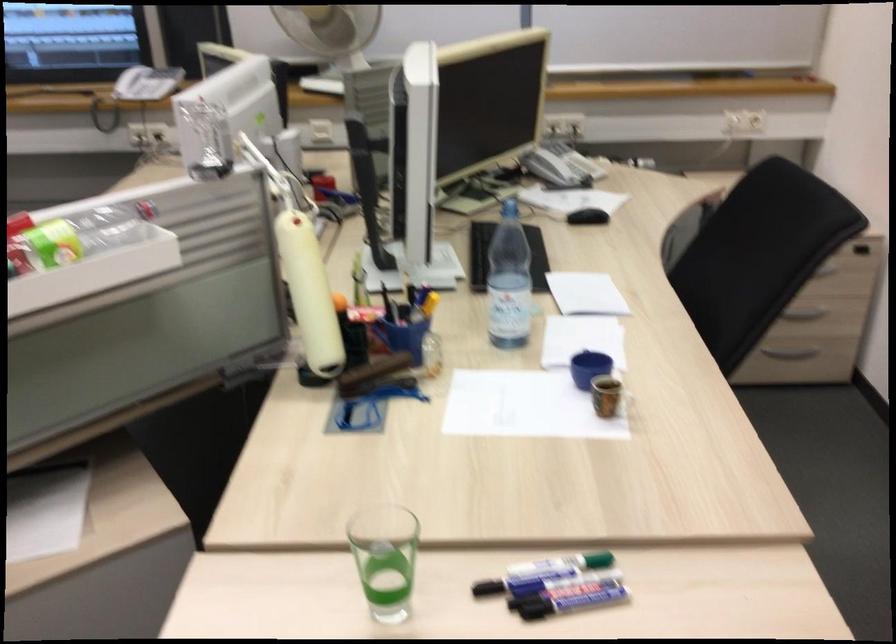
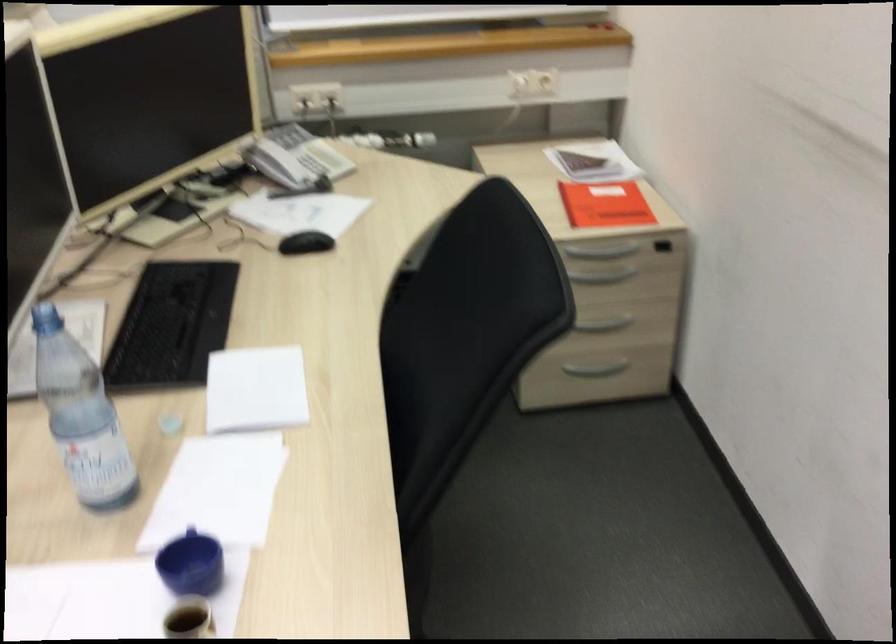
Which direction would the cameraman need to move to produce the second image?

The cameraman walked toward right, forward.